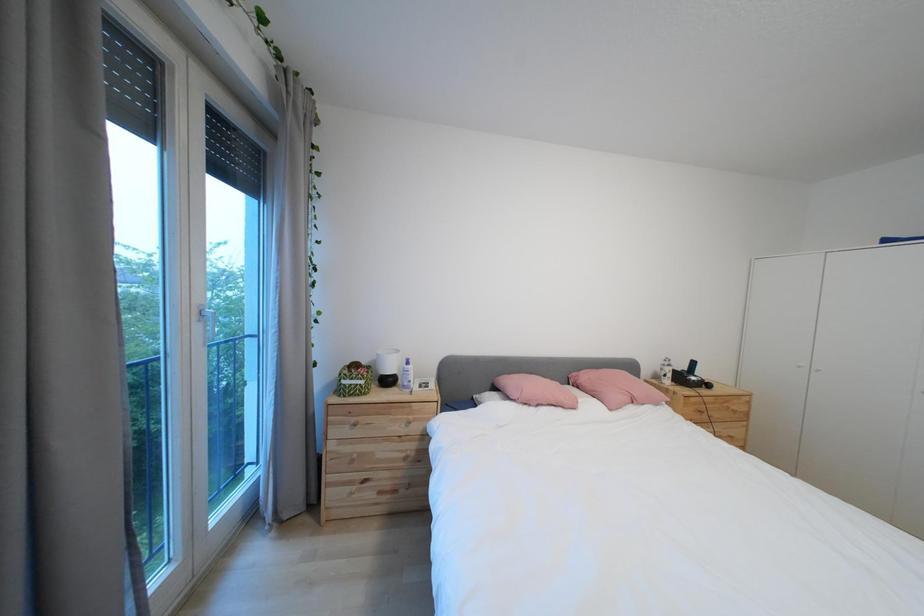
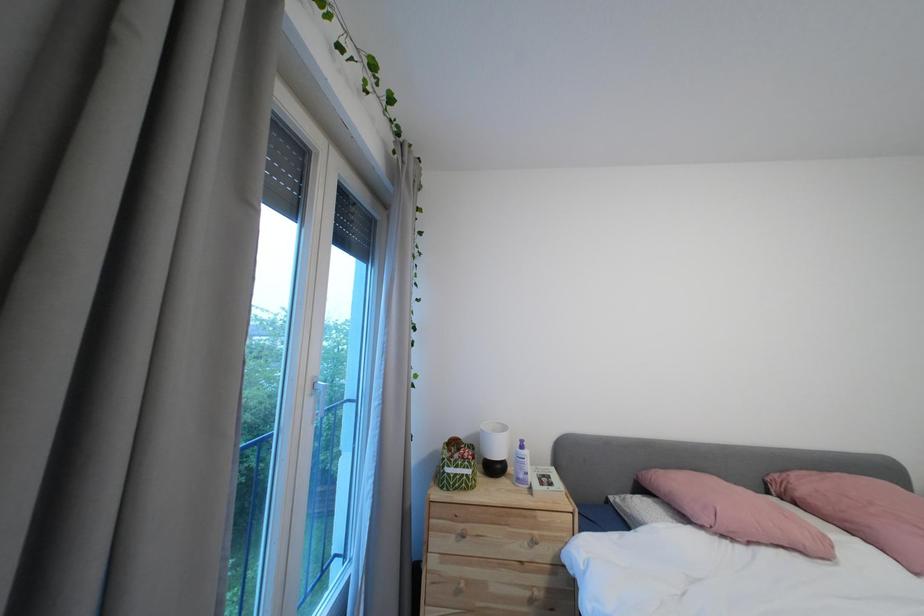
Question: The camera is either moving clockwise (left) or counter-clockwise (right) around the object. The first image is from the beginning of the video and the second image is from the end. Is the camera moving left or right when shooting the video?

Choices:
 (A) Left
 (B) Right

Answer: (B)